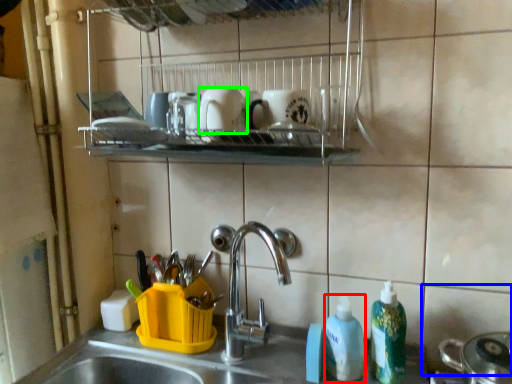
Question: Which is farther away from cleaning product (highlighted by a red box)? tile (highlighted by a blue box) or mug (highlighted by a green box)?

Choices:
 (A) tile
 (B) mug

Answer: (B)